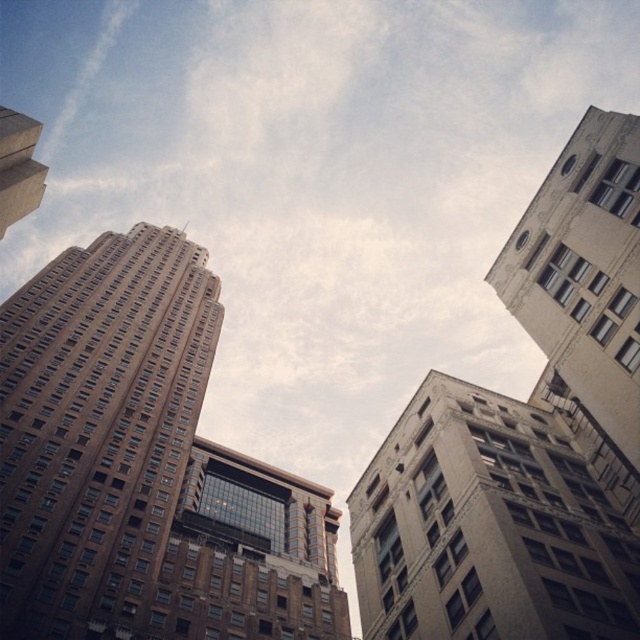
Between point (106, 436) and point (1, 193), which one is positioned behind?

The point (106, 436) is behind.

Between brown brick building at center and matte brown building at upper left, which one appears on the left side from the viewer's perspective?

From the viewer's perspective, brown brick building at center appears more on the left side.

I want to click on brown brick building at center, so click(99, 429).

Is gray concrete building at center wider than matte brown building at upper left?

No, gray concrete building at center is not wider than matte brown building at upper left.

Does point (424, 499) lie behind point (38, 184)?

That is True.

Locate an element on the screen. This screenshot has width=640, height=640. gray concrete building at center is located at coordinates (492, 524).

How much distance is there between brown brick building at center and gray concrete building at center?

brown brick building at center is 165.54 feet from gray concrete building at center.

In the scene shown: Between brown brick building at center and gray concrete building at center, which one has more height?

brown brick building at center

In order to click on brown brick building at center in this screenshot , I will do `click(99, 429)`.